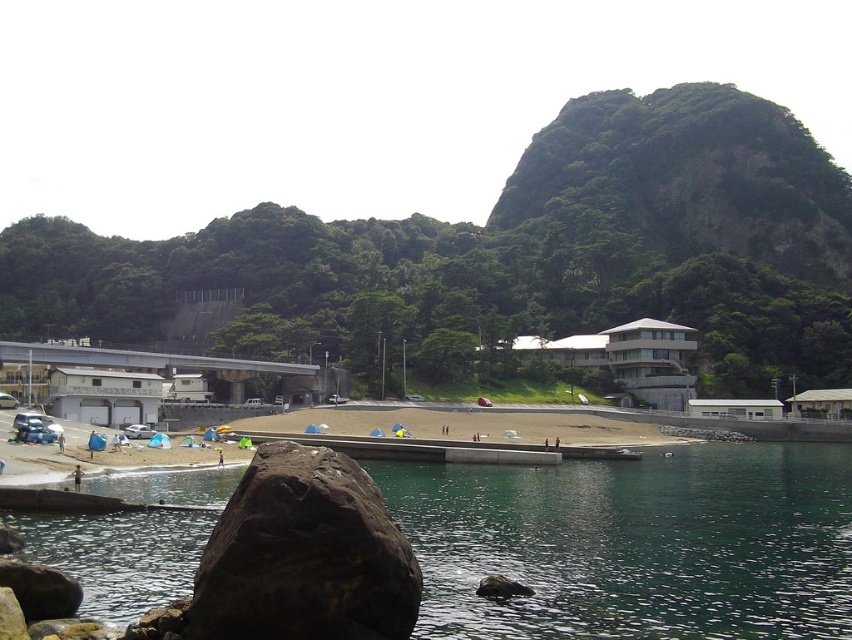
The width and height of the screenshot is (852, 640). What do you see at coordinates (511, 250) in the screenshot? I see `green leafy mountain at upper center` at bounding box center [511, 250].

The height and width of the screenshot is (640, 852). Identify the location of green leafy mountain at upper center. (511, 250).

Is dark brown rock at lower left further to camera compared to skinny person at lower left?

No, dark brown rock at lower left is closer to the viewer.

Is point (273, 481) more distant than point (76, 480)?

No, it is not.

The image size is (852, 640). Find the location of `dark brown rock at lower left`. dark brown rock at lower left is located at coordinates (304, 556).

Can you confirm if clear water at lower center is thinner than skinny person at lower left?

No.

Is clear water at lower center wider than skinny person at lower left?

Correct, the width of clear water at lower center exceeds that of skinny person at lower left.

Who is more forward, (507, 627) or (76, 484)?

Point (507, 627)

Locate an element on the screen. The height and width of the screenshot is (640, 852). clear water at lower center is located at coordinates (635, 544).